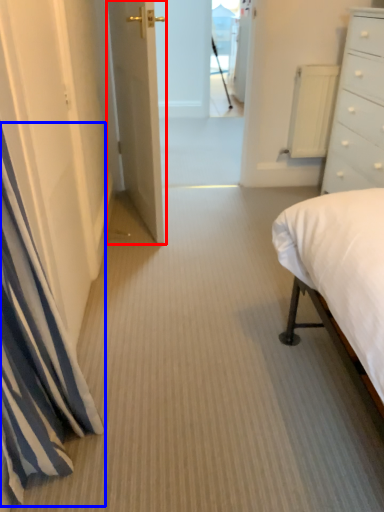
Question: Which point is closer to the camera, door (highlighted by a red box) or curtain (highlighted by a blue box)?

Choices:
 (A) door
 (B) curtain

Answer: (B)